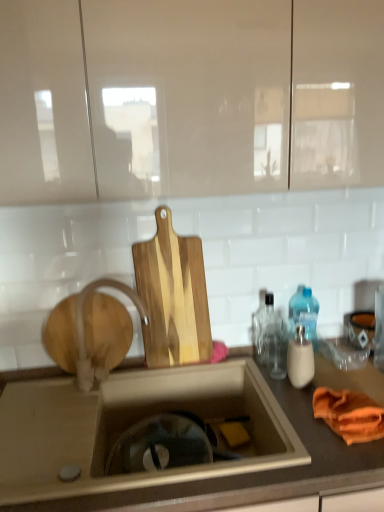
At what (x,y) coordinates should I click in order to perform the action: click on vacant point to the left of translucent glass bottle at right, positioned as the third bottle in back-to-front order. Please return your answer as a coordinate pair (x, y). Looking at the image, I should click on (263, 382).